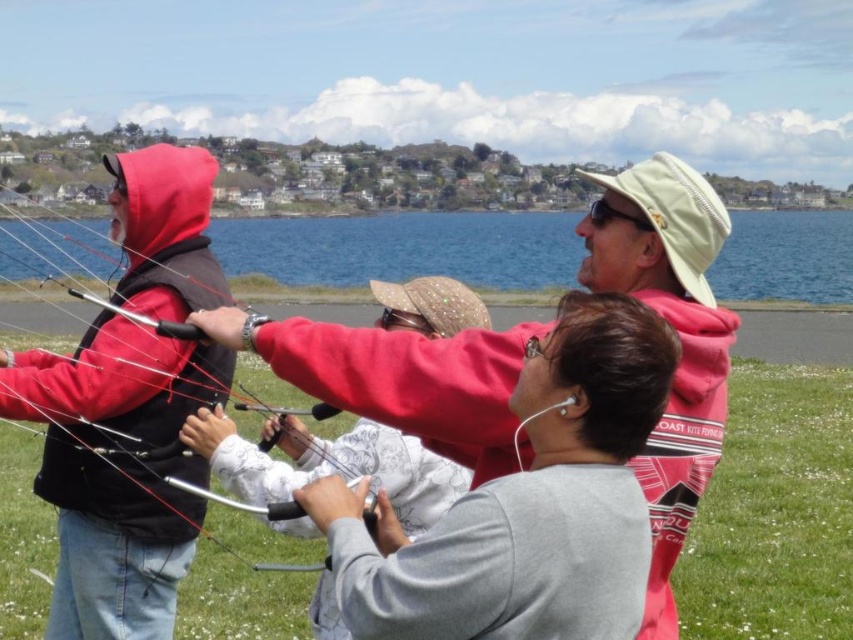
Is point (370, 410) positioned behind point (115, 196)?

That is False.

Measure the distance between point (x=616, y=280) and camera.

Point (x=616, y=280) is 146.78 feet from camera.

Is point (477, 442) more distant than point (293, 515)?

Yes, point (477, 442) is behind point (293, 515).

You are a GUI agent. You are given a task and a screenshot of the screen. Output one action in this format:
    pyautogui.click(x=<x>, y=<y>)
    Task: Click on the matte red hoodie at center
    
    Given the screenshot: What is the action you would take?
    pyautogui.click(x=677, y=337)

Can you confirm if blue water at upper center is positioned to the right of metallic silver string at center?

Indeed, blue water at upper center is positioned on the right side of metallic silver string at center.

Is blue water at upper center thinner than metallic silver string at center?

No, blue water at upper center is not thinner than metallic silver string at center.

This screenshot has width=853, height=640. In order to click on blue water at upper center in this screenshot , I will do `click(404, 248)`.

Which is behind, point (451, 348) or point (511, 230)?

Point (511, 230)

Which of these two, matte red hoodie at center or blue water at upper center, stands taller?

With more height is blue water at upper center.

Image resolution: width=853 pixels, height=640 pixels. What are the coordinates of `matte red hoodie at center` in the screenshot? It's located at (677, 337).